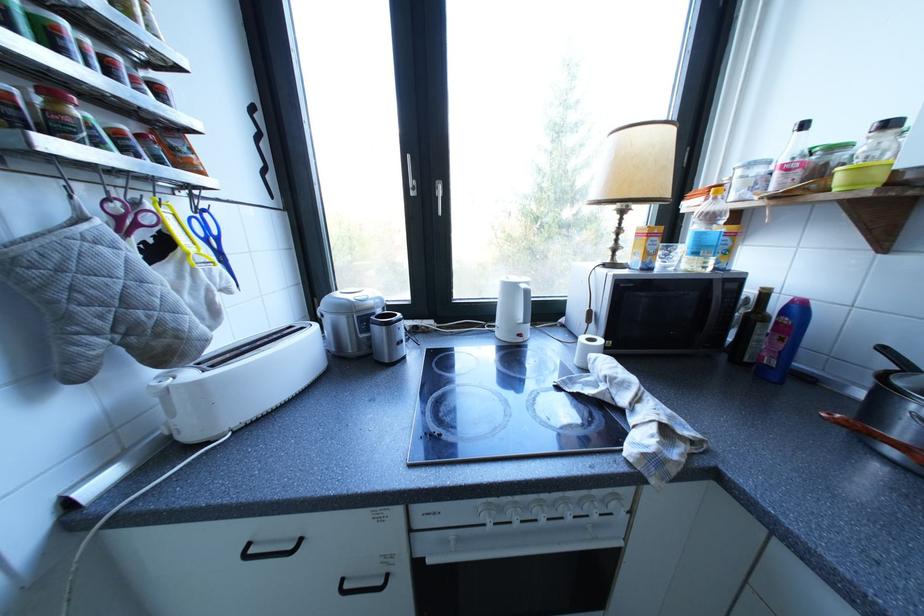
Where is `microwave door handle`? The height and width of the screenshot is (616, 924). microwave door handle is located at coordinates (723, 308).